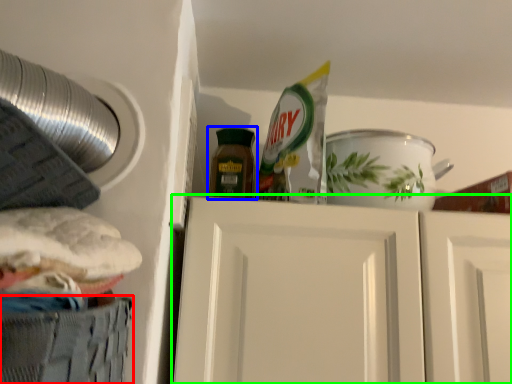
Question: Which is nearer to the cabinetry (highlighted by a red box)? bottle (highlighted by a blue box) or door (highlighted by a green box).

Choices:
 (A) bottle
 (B) door

Answer: (B)